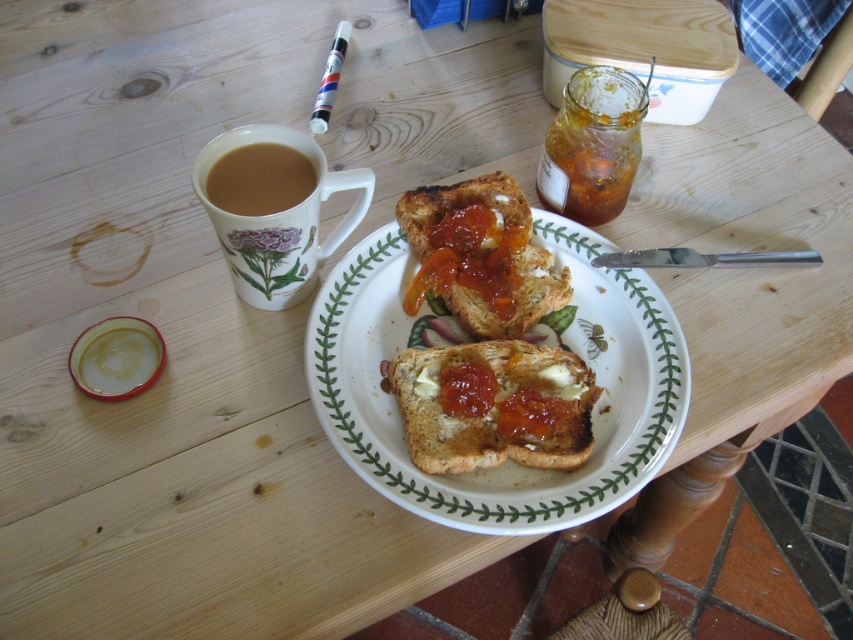
Who is positioned more to the left, golden brown toast at center or translucent amber jam at upper right?

From the viewer's perspective, golden brown toast at center appears more on the left side.

Does point (496, 202) come in front of point (619, 152)?

That is False.

Who is more distant from viewer, (526, 324) or (587, 132)?

The point (587, 132) is behind.

Where is `golden brown toast at center`? The width and height of the screenshot is (853, 640). golden brown toast at center is located at coordinates (486, 337).

Which is behind, point (428, 195) or point (276, 157)?

Point (428, 195)

The height and width of the screenshot is (640, 853). Describe the element at coordinates (486, 337) in the screenshot. I see `golden brown toast at center` at that location.

Measure the distance between golden brown toast at center and camera.

They are 61.64 centimeters apart.

The height and width of the screenshot is (640, 853). I want to click on golden brown toast at center, so click(486, 337).

Does point (379, 321) come closer to viewer compared to point (467, 310)?

No, (379, 321) is behind (467, 310).

The height and width of the screenshot is (640, 853). What are the coordinates of `white ceramic plate at center` in the screenshot? It's located at (506, 465).

The width and height of the screenshot is (853, 640). I want to click on white ceramic plate at center, so click(506, 465).